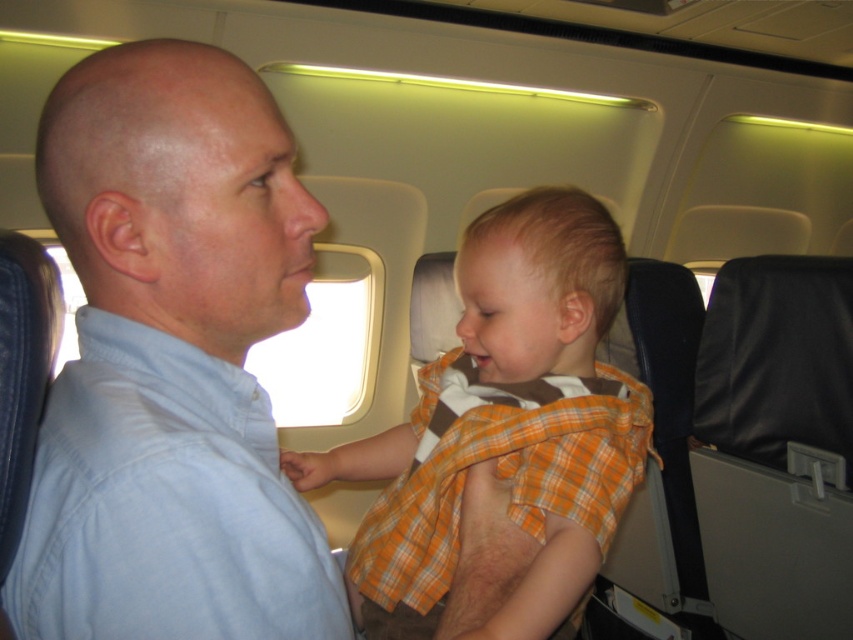
You are seated in an airplane cabin and notice the light blue shirt at center. Based on its position coordinates, can you determine if it is closer to the front or the back of the cabin?

The light blue shirt at center is located at point coordinates that are typically closer to the front of the cabin in such settings, so it is likely positioned near the front.